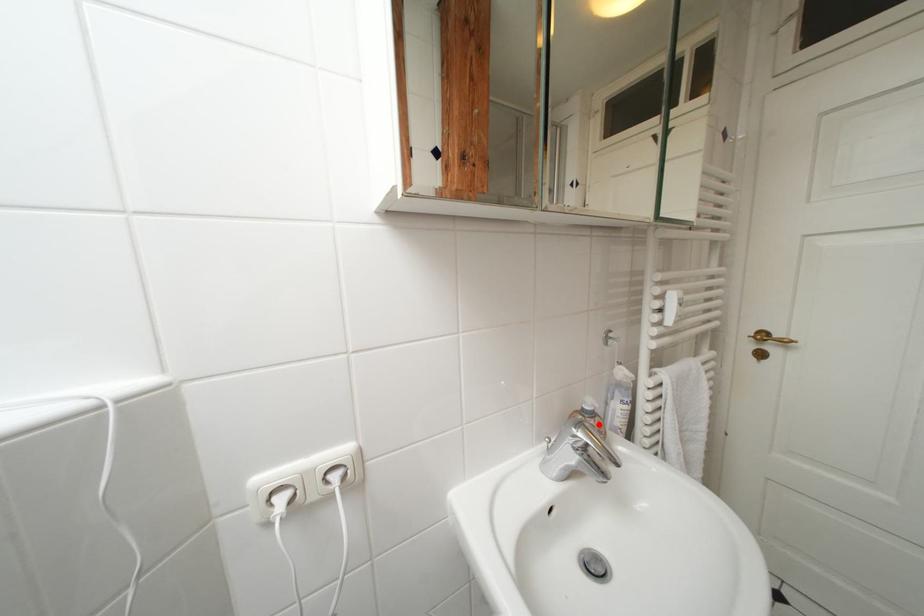
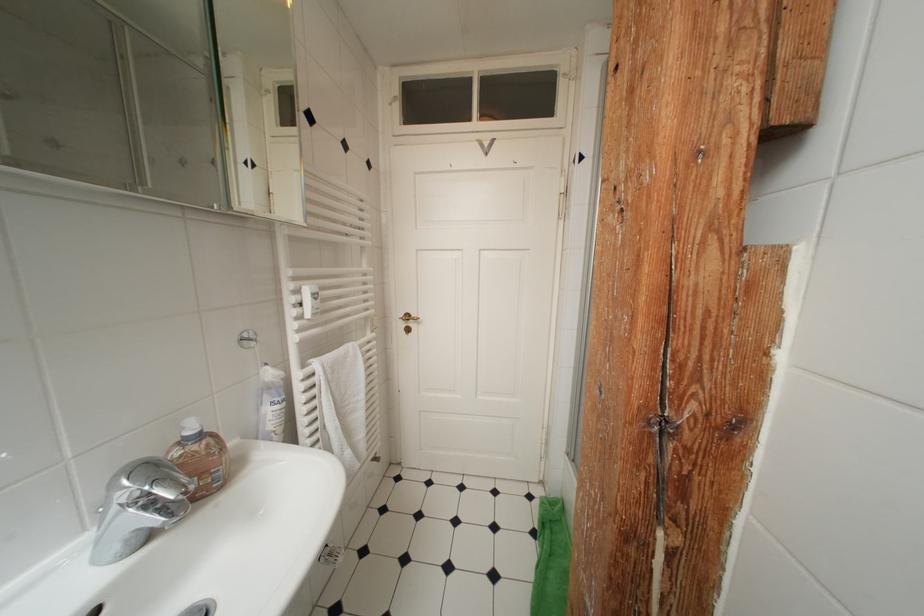
The point at the highlighted location is marked in the first image. Where is the corresponding point in the second image?

(201, 451)